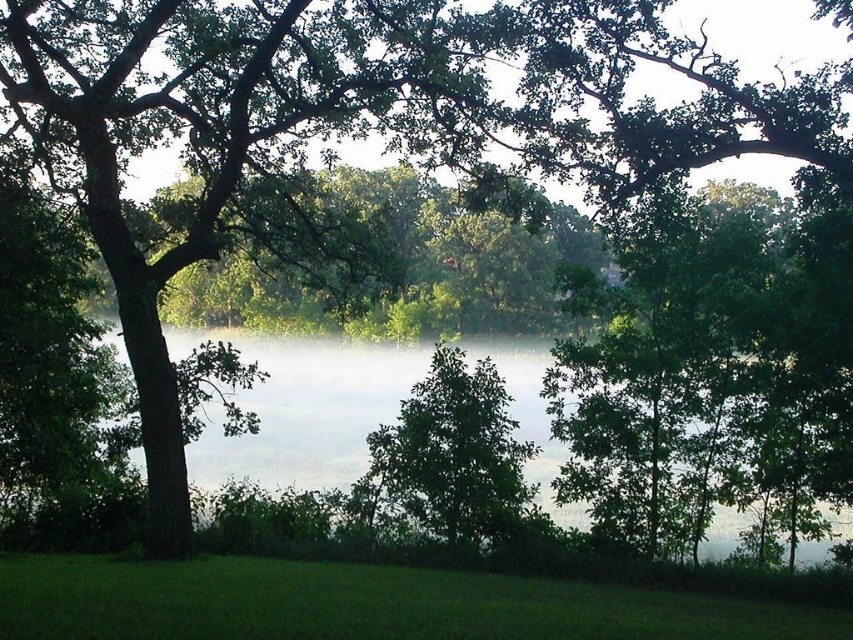
Does misty water at center have a lesser height compared to green leafy tree at center?

Incorrect, misty water at center's height does not fall short of green leafy tree at center's.

Locate an element on the screen. misty water at center is located at coordinates (300, 408).